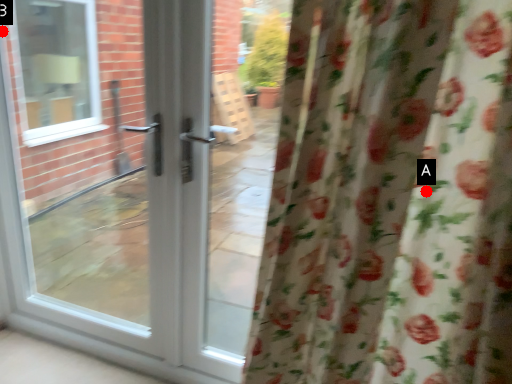
Question: Two points are circled on the image, labeled by A and B beside each circle. Which of the following is the farthest from the observer?

Choices:
 (A) A is further
 (B) B is further

Answer: (B)